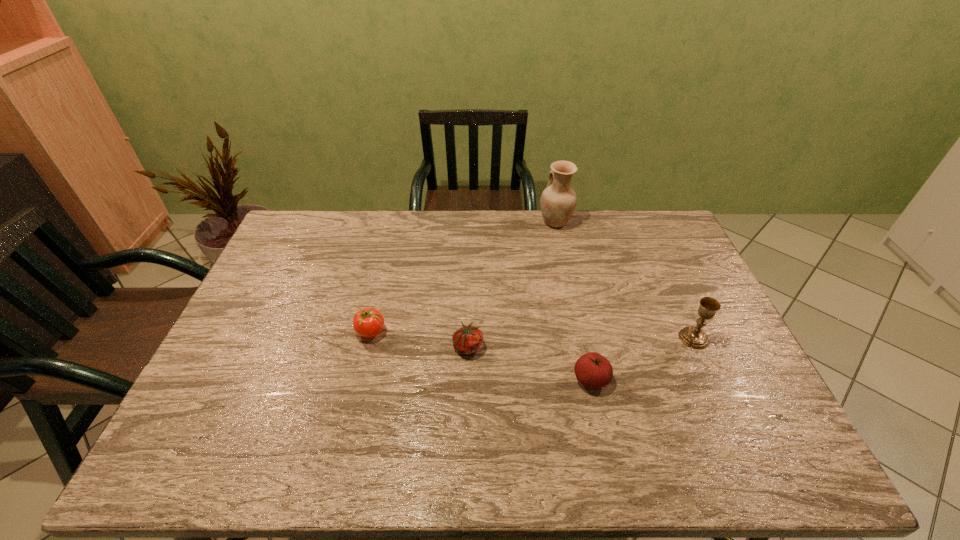
This screenshot has width=960, height=540. Identify the location of the tallest object. (558, 201).

You are a GUI agent. You are given a task and a screenshot of the screen. Output one action in this format:
    pyautogui.click(x=<x>, y=<y>)
    Task: Click on the farthest object
    This screenshot has width=960, height=540.
    Given the screenshot: What is the action you would take?
    pyautogui.click(x=558, y=201)

Locate an element on the screen. the rightmost object is located at coordinates (694, 337).

This screenshot has width=960, height=540. I want to click on chalice, so click(694, 337).

Locate an element on the screen. the rightmost tomato is located at coordinates (593, 370).

Where is `the nearest object`? the nearest object is located at coordinates (x=593, y=370).

You are a GUI agent. You are given a task and a screenshot of the screen. Output one action in this format:
    pyautogui.click(x=<x>, y=<y>)
    Task: Click on the leftmost object
    The height and width of the screenshot is (540, 960).
    Given the screenshot: What is the action you would take?
    pyautogui.click(x=368, y=322)

The width and height of the screenshot is (960, 540). I want to click on the shortest object, so click(x=467, y=340).

This screenshot has width=960, height=540. Find the location of `the shortest tomato`. the shortest tomato is located at coordinates (467, 340).

Where is `free space located 0.330m on the front of the tallest object`? The width and height of the screenshot is (960, 540). free space located 0.330m on the front of the tallest object is located at coordinates (571, 296).